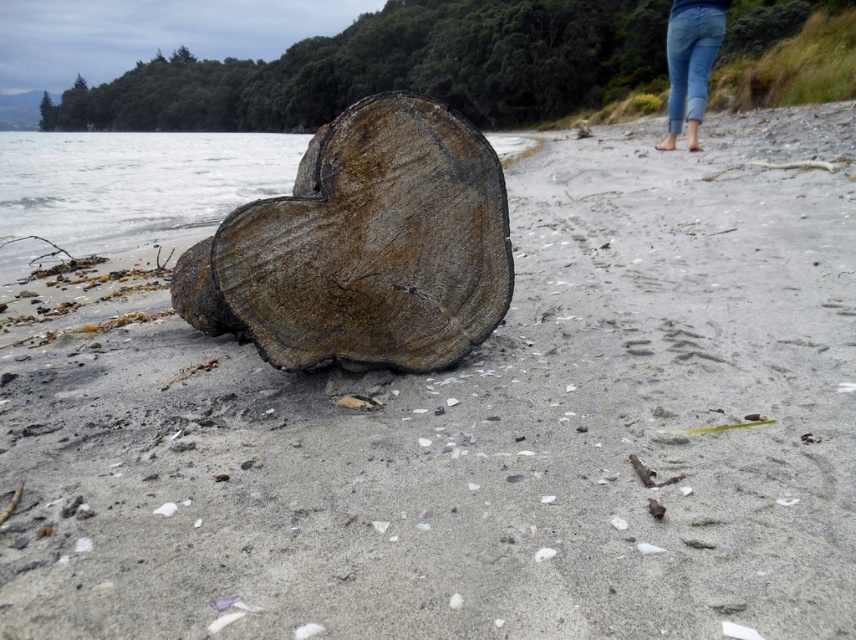
You are standing at the edge of the beach looking towards the water. You see two points marked on the sand. Which point is closer to you, point (465, 282) or point (706, 13)?

Point (465, 282) is closer to you than point (706, 13).

You are a photographer setting up a shot at the beach. You have a rusty metallic heart at center and blue denim jeans at upper right in your frame. Which object should you adjust to ensure both are equally visible in your composition?

The rusty metallic heart at center is not as tall as blue denim jeans at upper right, so you should adjust the blue denim jeans at upper right to reduce its height or move the rusty metallic heart at center to increase its height in the frame.